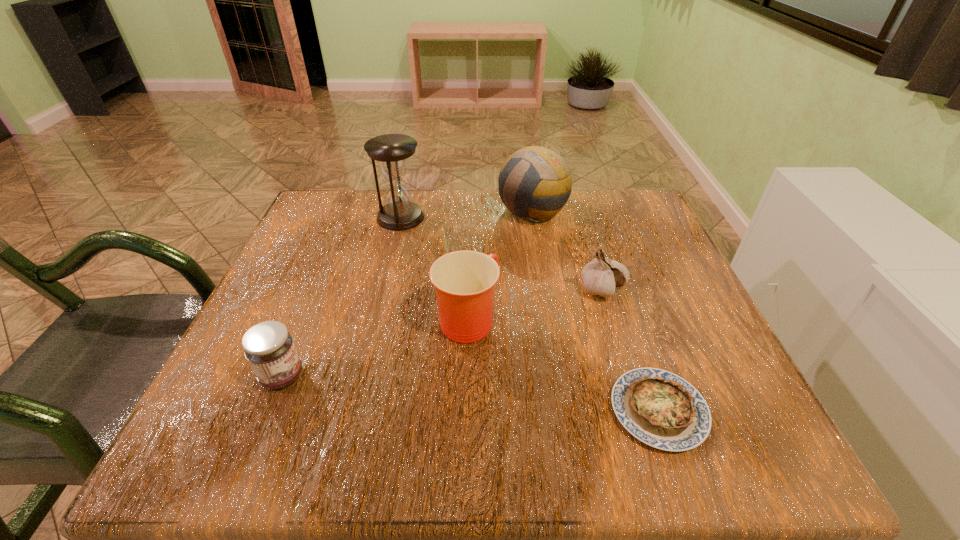
The image size is (960, 540). I want to click on hourglass, so click(391, 151).

At what (x,y) coordinates should I click in order to perform the action: click on volleyball. Please return your answer as a coordinate pair (x, y). Looking at the image, I should click on (539, 178).

Locate an element on the screen. the fourth object from right to left is located at coordinates (464, 281).

This screenshot has height=540, width=960. I want to click on garlic, so click(601, 276).

At what (x,y) coordinates should I click in order to perform the action: click on the leftmost object. Please return your answer as a coordinate pair (x, y). The height and width of the screenshot is (540, 960). Looking at the image, I should click on (268, 346).

Where is `quiche`? Image resolution: width=960 pixels, height=540 pixels. quiche is located at coordinates (661, 409).

The width and height of the screenshot is (960, 540). I want to click on free region located on the right of the second object from left to right, so click(557, 217).

The width and height of the screenshot is (960, 540). I want to click on vacant space located on the front of the volleyball, so click(x=547, y=300).

The image size is (960, 540). In order to click on vacant region located on the left of the cup in this screenshot , I will do `click(374, 319)`.

This screenshot has width=960, height=540. Identify the location of vacant space located 0.240m on the back of the garlic. (578, 211).